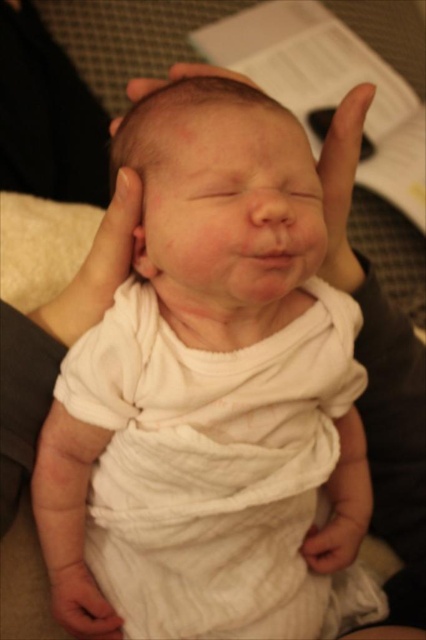
Question: In this image, where is white cotton baby at center located relative to smooth skin head at center?

Choices:
 (A) left
 (B) right

Answer: (A)

Question: Which of the following is the farthest from the observer?

Choices:
 (A) white cotton baby at center
 (B) smooth skin head at center

Answer: (A)

Question: In this image, where is white cotton baby at center located relative to white soft cloth at lower center?

Choices:
 (A) above
 (B) below

Answer: (A)

Question: Which of the following is the closest to the observer?

Choices:
 (A) (115, 627)
 (B) (298, 364)

Answer: (B)

Question: Which object appears farthest from the camera in this image?

Choices:
 (A) white soft cloth at lower center
 (B) white cotton baby at center

Answer: (A)

Question: Does white cotton baby at center come behind white soft cloth at lower center?

Choices:
 (A) no
 (B) yes

Answer: (A)